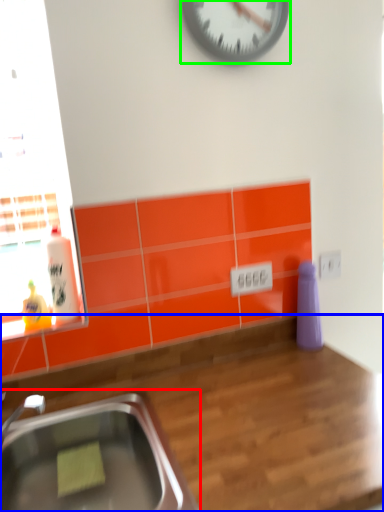
Question: Based on their relative distances, which object is nearer to sink (highlighted by a red box)? Choose from countertop (highlighted by a blue box) and wall clock (highlighted by a green box).

Choices:
 (A) countertop
 (B) wall clock

Answer: (A)